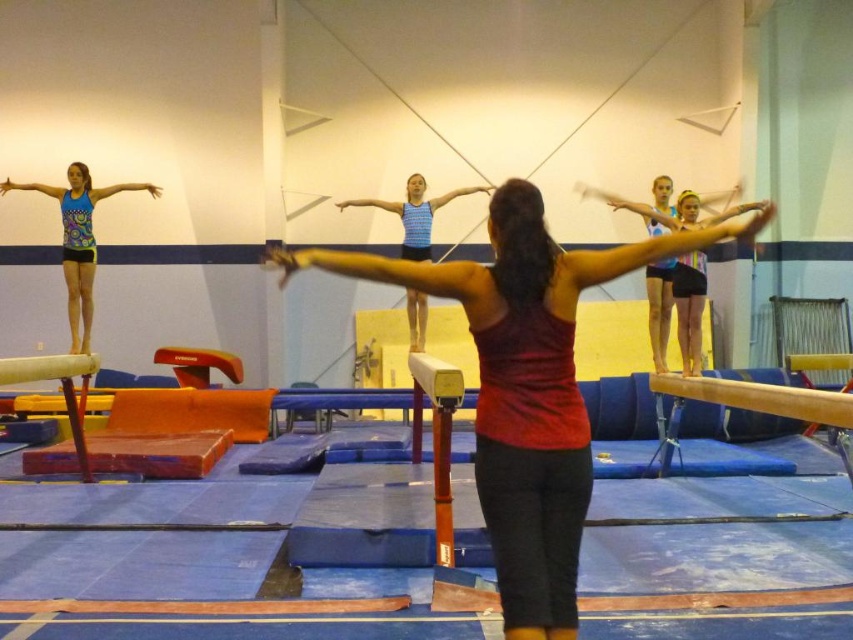
You are a gymnast standing at the edge of the gymnasium floor. You need to move from the red matte tank top at center to the blue striped tank top at center. Is the distance between them sufficient for you to walk directly from one to the other without needing to detour around any obstacles?

The distance between the red matte tank top at center and the blue striped tank top at center is 19.03 feet, which is more than enough for a gymnast to walk directly between them without needing to detour around obstacles.

In the scene shown: You are a gymnast trying to avoid the instructor to practice your moves freely. The instructor is wearing the red matte tank top at center. Where should you position yourself relative to the wooden beam at right to stay out of the instructor?

The red matte tank top at center has a larger size compared to wooden beam at right, so positioning yourself behind the wooden beam at right would place you out of the instructor?

You are a gymnast trying to determine which point is closer to the camera in the image. The points are labeled as point (515, 284) and point (430, 204). Which point is closer?

Point (515, 284) is closer to the camera than point (430, 204).